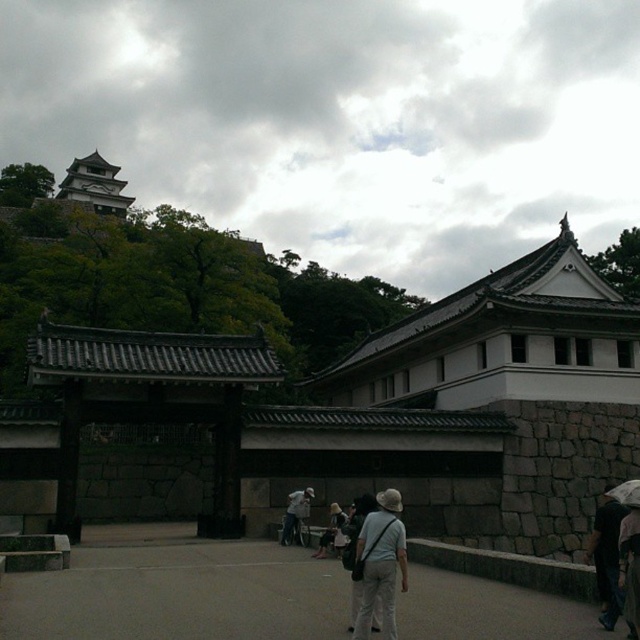
You are a photographer standing at the entrance of the traditional Japanese gate. You notice a dark brown leather backpack at lower right and a dark gray fabric hat at lower right. Which object is wider?

The dark brown leather backpack at lower right is wider than the dark gray fabric hat at lower right, as its width surpasses that of the hat.

You are standing at the center of the paved pathway leading to the gate in this Japanese architectural scene. You want to take a photo of the stone gray stone wall at left without moving your position. Is the wall visible in your current field of view?

The stone gray stone wall at left is located at point [316,397] in the image, which is to the left side of the scene. Since you are at the center of the pathway facing towards the gate, the wall should be visible in your peripheral vision to the left. However, without moving your position, you may need to adjust your camera angle slightly to fully capture the wall in your field of view.